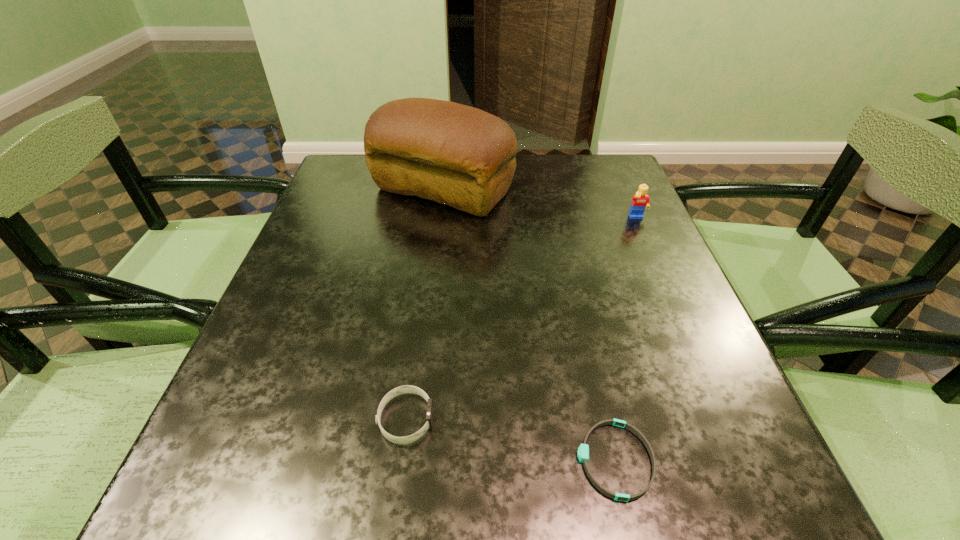
At what (x,y) coordinates should I click in order to perform the action: click on vacant space positioned 0.310m on the buckle of the shortest object. Please return your answer as a coordinate pair (x, y). Looking at the image, I should click on tap(356, 460).

Identify the location of vacant space located 0.270m on the buckle of the shortest object. (385, 460).

The image size is (960, 540). Identify the location of free space located 0.300m on the buckle of the shortest object. (364, 460).

Locate an element on the screen. The height and width of the screenshot is (540, 960). object present at the far edge is located at coordinates (457, 155).

Identify the location of object situated at the near edge. This screenshot has height=540, width=960. (583, 451).

Locate an element on the screen. This screenshot has width=960, height=540. object present at the left edge is located at coordinates (457, 155).

I want to click on Lego located at the right edge, so click(641, 200).

Find the location of a particular element. wristband at the right edge is located at coordinates (583, 451).

Where is `object that is positioned at the far left corner`? The image size is (960, 540). object that is positioned at the far left corner is located at coordinates (457, 155).

The height and width of the screenshot is (540, 960). Find the location of `object at the near right corner`. object at the near right corner is located at coordinates (583, 451).